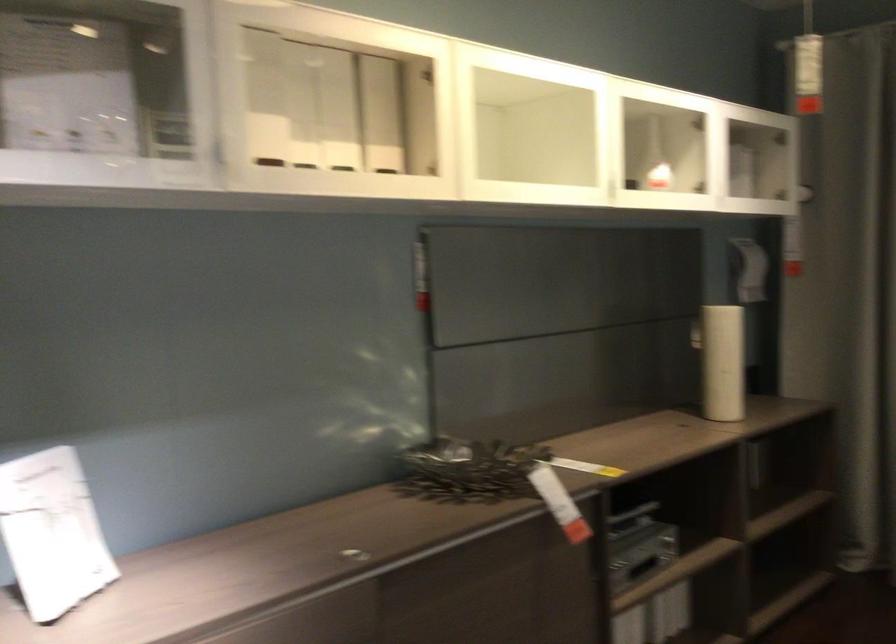
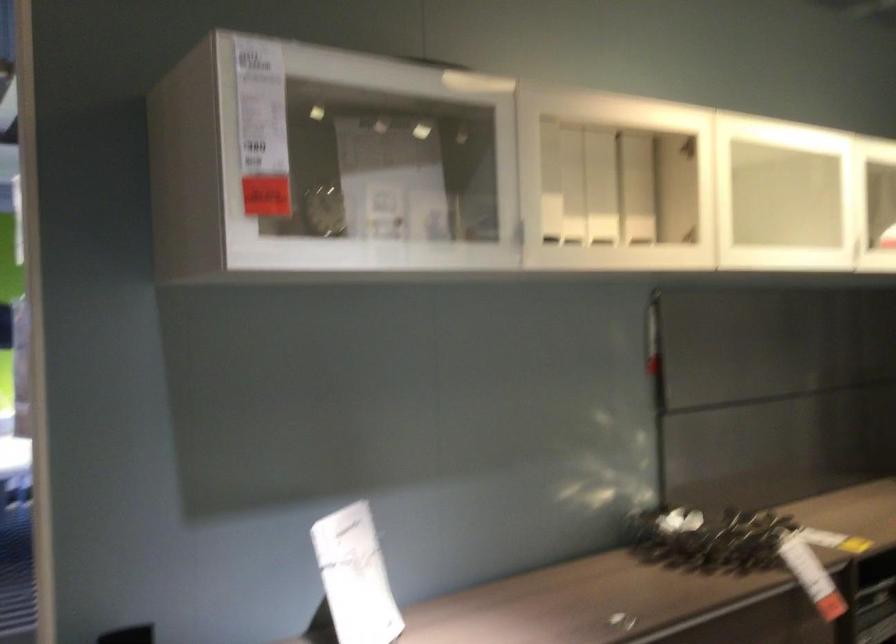
Locate, in the second image, the point that corresponds to the point at 280,102 in the first image.

(549, 182)